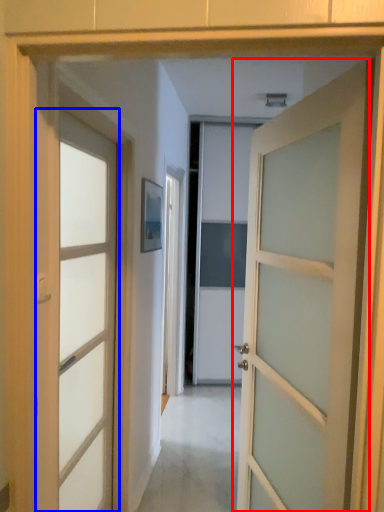
Question: Among these objects, which one is farthest to the camera, door (highlighted by a red box) or door (highlighted by a blue box)?

Choices:
 (A) door
 (B) door

Answer: (B)